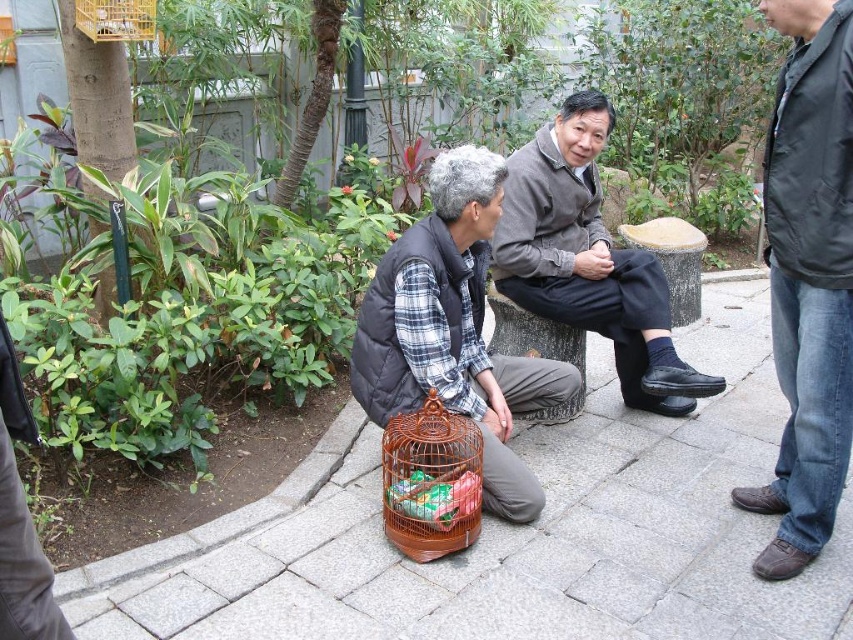
You are organizing a small picnic basket and have both the brown wire birdcage at lower center and the gray wool sweater at center. Which item can you fit into the basket first without folding or rearranging anything else?

The brown wire birdcage at lower center can be fit into the basket first because it is smaller than the gray wool sweater at center.

You are a photographer standing at the center of the scene. You want to take a picture of the brown woven birdcage at lower center. Where should you position your camera relative to the birdcage to ensure it is centered in your shot?

The brown woven birdcage at lower center is located at coordinates approximately 0.752 on the horizontal axis and 0.506 on the vertical axis. To center it in your photo, position your camera so that the birdcage aligns with the center point of your viewfinder, which would require moving slightly to the right and slightly downward from your current position at the scene center.

You are standing at the center of the paved area in the park. There is a black matte jacket at right located at point (x=808, y=278). If you face north, which direction should you walk to reach the black matte jacket at right?

Since the black matte jacket at right is located at point (x=808, y=278), which is to the east of your current position at the center, you should walk east to reach it.